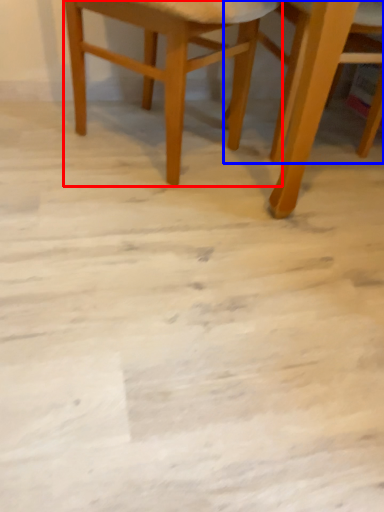
Question: Among these objects, which one is nearest to the camera, chair (highlighted by a red box) or chair (highlighted by a blue box)?

Choices:
 (A) chair
 (B) chair

Answer: (B)